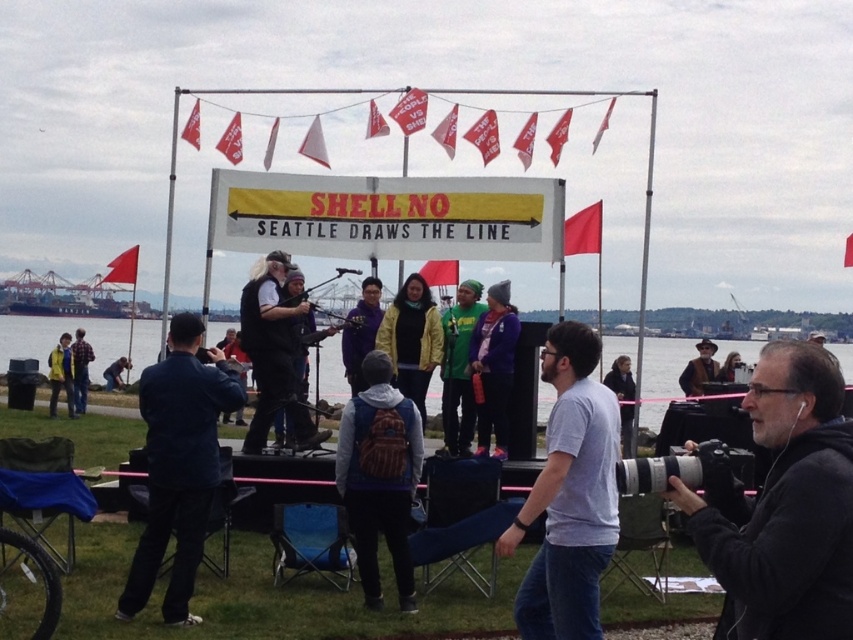
Looking at this image, between black matte camera at lower right and brown leather jacket at center, which one appears on the right side from the viewer's perspective?

From the viewer's perspective, brown leather jacket at center appears more on the right side.

Does black matte camera at lower right have a lesser width compared to brown leather jacket at center?

Indeed, black matte camera at lower right has a lesser width compared to brown leather jacket at center.

Find the location of a particular element. black matte camera at lower right is located at coordinates (784, 506).

Is gray cotton t-shirt at center to the right of brown leather jacket at center from the viewer's perspective?

In fact, gray cotton t-shirt at center is to the left of brown leather jacket at center.

Can you confirm if gray cotton t-shirt at center is smaller than brown leather jacket at center?

Yes, gray cotton t-shirt at center is smaller than brown leather jacket at center.

Which is behind, point (566, 497) or point (700, 364)?

Positioned behind is point (700, 364).

You are a GUI agent. You are given a task and a screenshot of the screen. Output one action in this format:
    pyautogui.click(x=<x>, y=<y>)
    Task: Click on the gray cotton t-shirt at center
    The width and height of the screenshot is (853, 640).
    Given the screenshot: What is the action you would take?
    pyautogui.click(x=569, y=496)

Is green grass at lower center wider than brown leather jacket at center?

Indeed, green grass at lower center has a greater width compared to brown leather jacket at center.

Which is behind, point (20, 317) or point (692, 362)?

Point (20, 317)

Is point (646, 422) closer to camera compared to point (712, 368)?

No.

At what (x,y) coordinates should I click in order to perform the action: click on green grass at lower center. Please return your answer as a coordinate pair (x, y). Image resolution: width=853 pixels, height=640 pixels. Looking at the image, I should click on (57, 337).